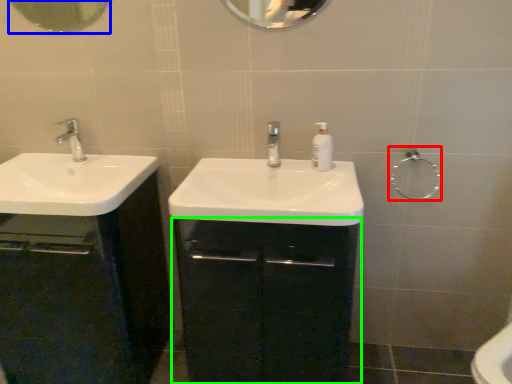
Question: Which object is the closest to the shower (highlighted by a red box)? Choose among these: mirror (highlighted by a blue box) or bathroom cabinet (highlighted by a green box).

Choices:
 (A) mirror
 (B) bathroom cabinet

Answer: (B)